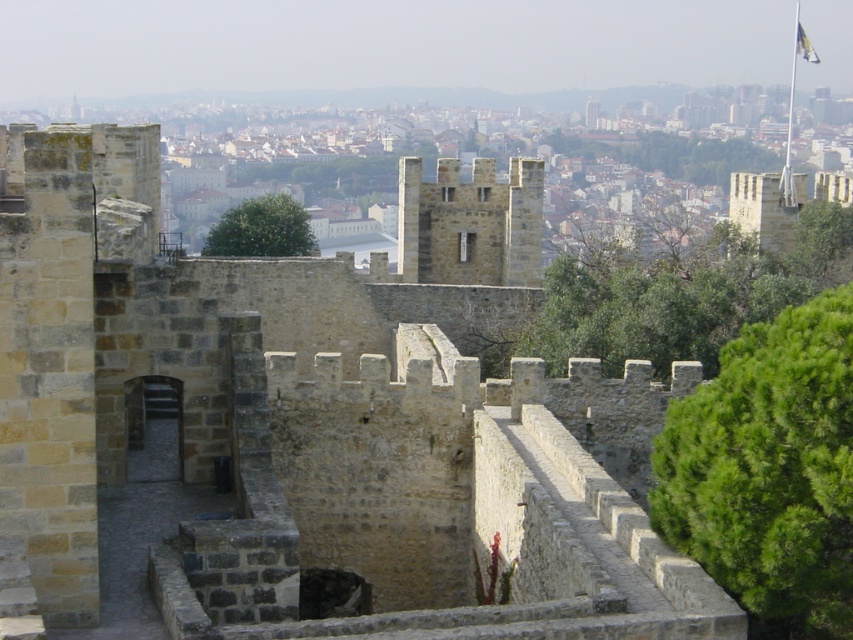
Question: Which of the following is the closest to the observer?

Choices:
 (A) (376, 467)
 (B) (809, 49)

Answer: (A)

Question: Which point is farther to the camera?

Choices:
 (A) (349, 484)
 (B) (807, 54)

Answer: (B)

Question: Does stone wall at center appear on the left side of white fabric flag at upper right?

Choices:
 (A) yes
 (B) no

Answer: (A)

Question: Is the position of stone wall at center more distant than that of white fabric flag at upper right?

Choices:
 (A) yes
 (B) no

Answer: (B)

Question: Is stone wall at center bigger than white fabric flag at upper right?

Choices:
 (A) no
 (B) yes

Answer: (A)